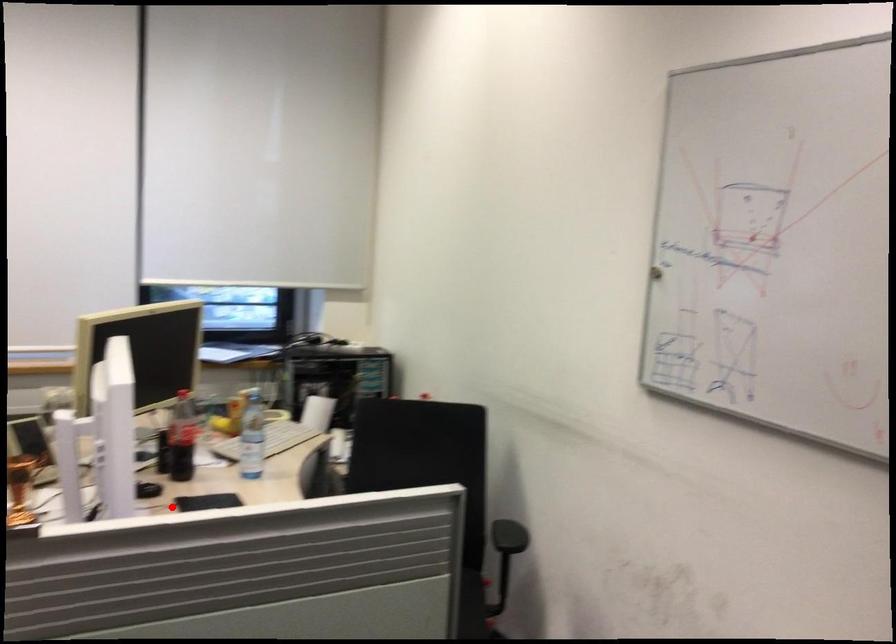
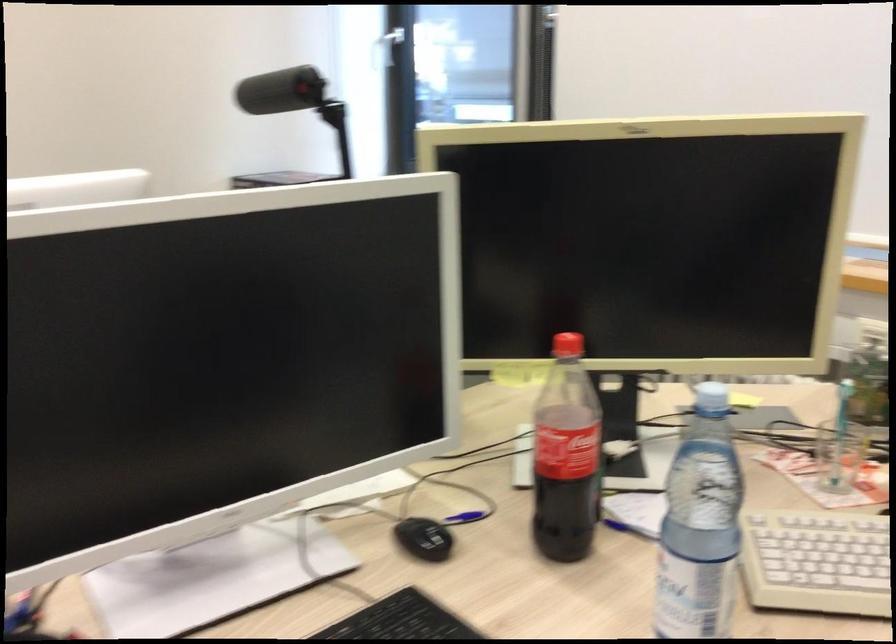
The point at the highlighted location is marked in the first image. Where is the corresponding point in the second image?

(401, 620)